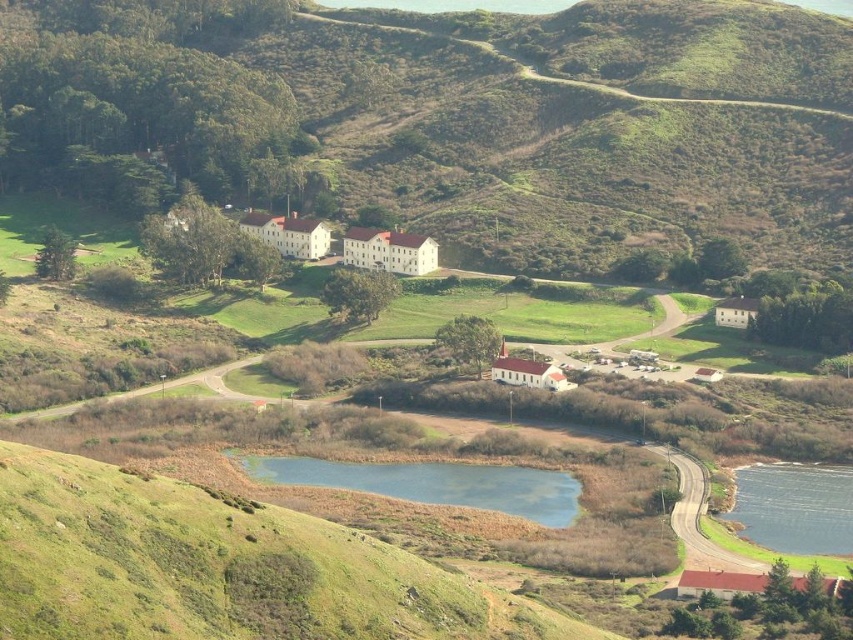
Can you confirm if green grassy hill at upper center is wider than blue grassy lake at center?

Yes.

Can you confirm if green grassy hill at upper center is thinner than blue grassy lake at center?

No.

Is point (833, 100) positioned in front of point (335, 467)?

No, it is not.

Locate an element on the screen. This screenshot has width=853, height=640. green grassy hill at upper center is located at coordinates (463, 116).

Which is more to the left, green grassy hill at upper center or blue glassy lake at lower right?

green grassy hill at upper center

Is point (300, 45) positioned after point (817, 500)?

Yes, point (300, 45) is farther from viewer.

Does point (173, 96) come farther from viewer compared to point (782, 522)?

Yes.

This screenshot has height=640, width=853. Identify the location of green grassy hill at upper center. (463, 116).

Can you confirm if blue grassy lake at center is shorter than blue glassy lake at lower right?

Indeed, blue grassy lake at center has a lesser height compared to blue glassy lake at lower right.

Which is more to the left, blue grassy lake at center or blue glassy lake at lower right?

blue grassy lake at center

At what (x,y) coordinates should I click in order to perform the action: click on blue grassy lake at center. Please return your answer as a coordinate pair (x, y). This screenshot has height=640, width=853. Looking at the image, I should click on (434, 483).